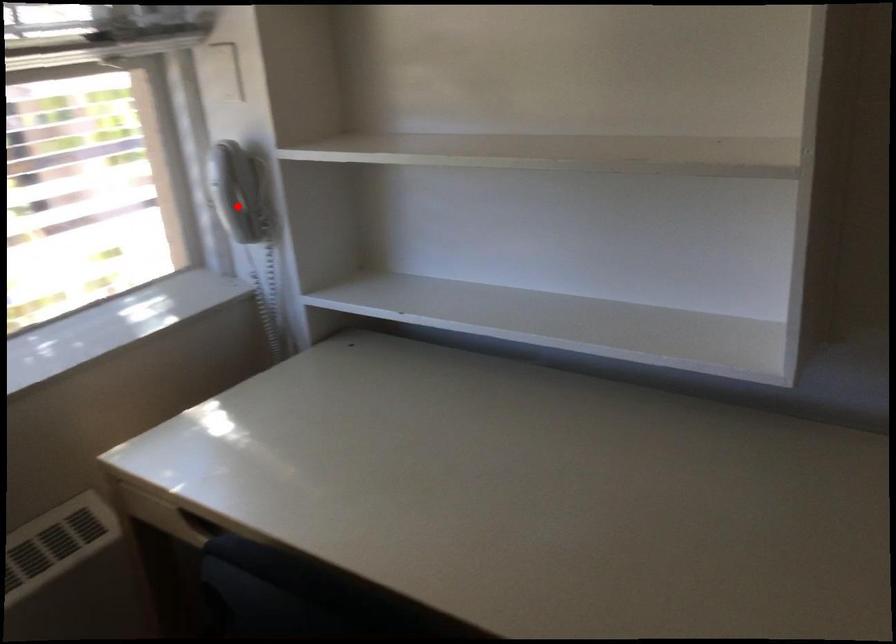
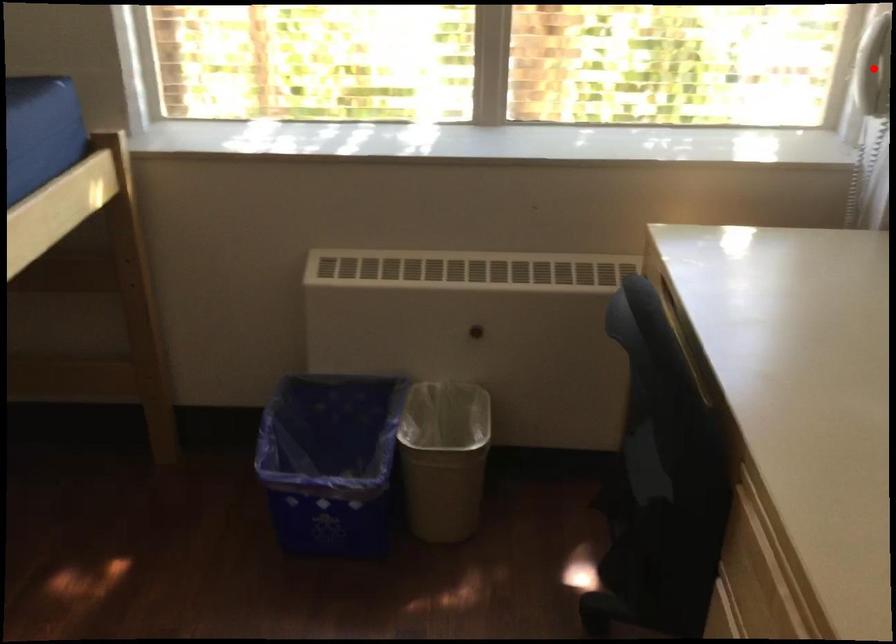
I am providing you with two images of the same scene from different viewpoints. A red point is marked on the first image and another point is marked on the second image. Does the point marked in image1 correspond to the same location as the one in image2?

Yes